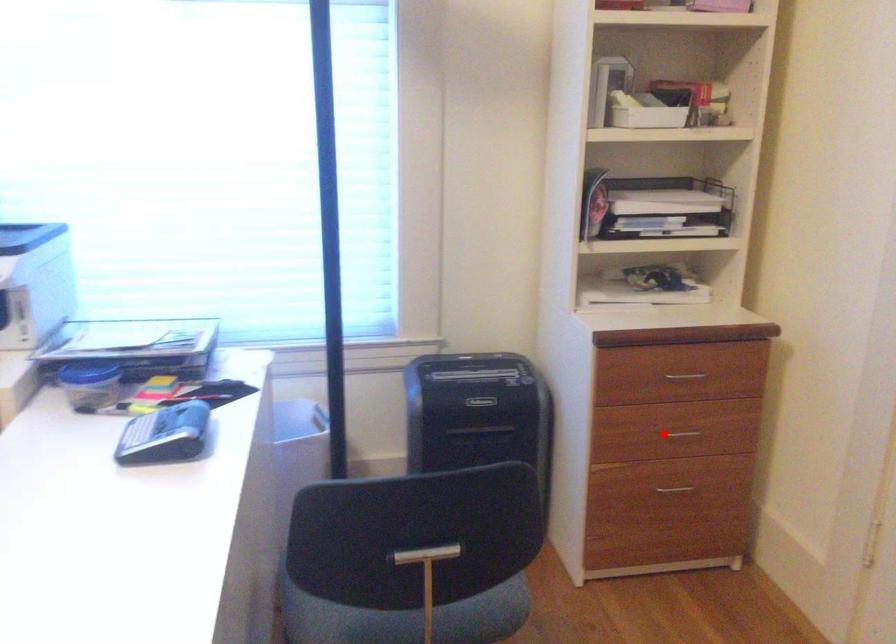
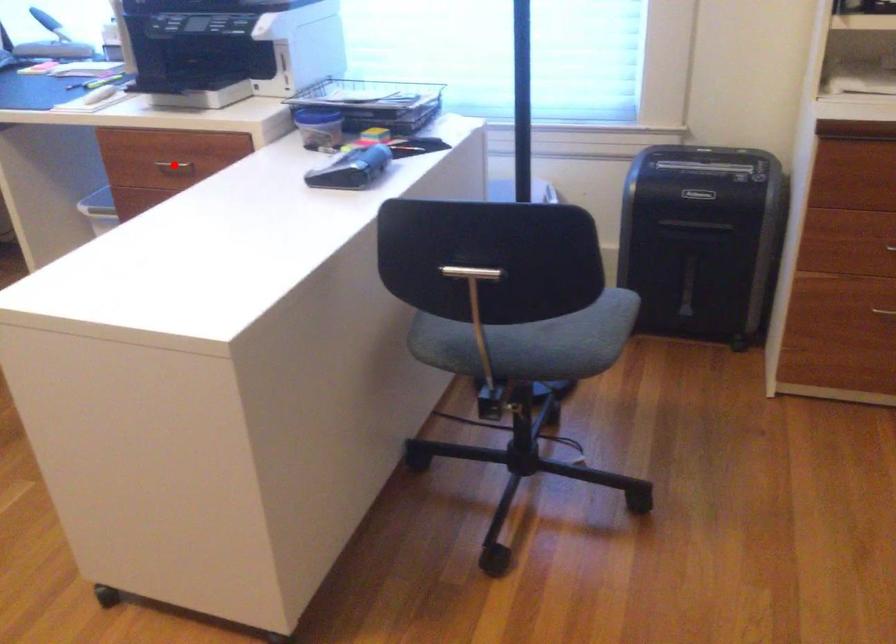
I am providing you with two images of the same scene from different viewpoints. A red point is marked on the first image and another point is marked on the second image. Do the highlighted points in image1 and image2 indicate the same real-world spot?

No